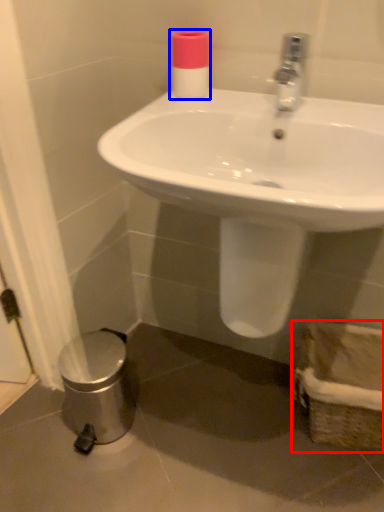
Question: Which object appears closest to the camera in this image, basket (highlighted by a red box) or toiletry (highlighted by a blue box)?

Choices:
 (A) basket
 (B) toiletry

Answer: (B)